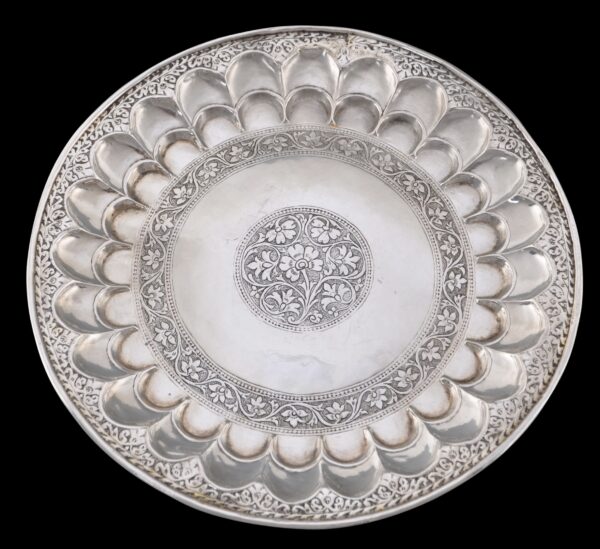
Identify the location of silver antique plate. The image size is (600, 549). (379, 350).